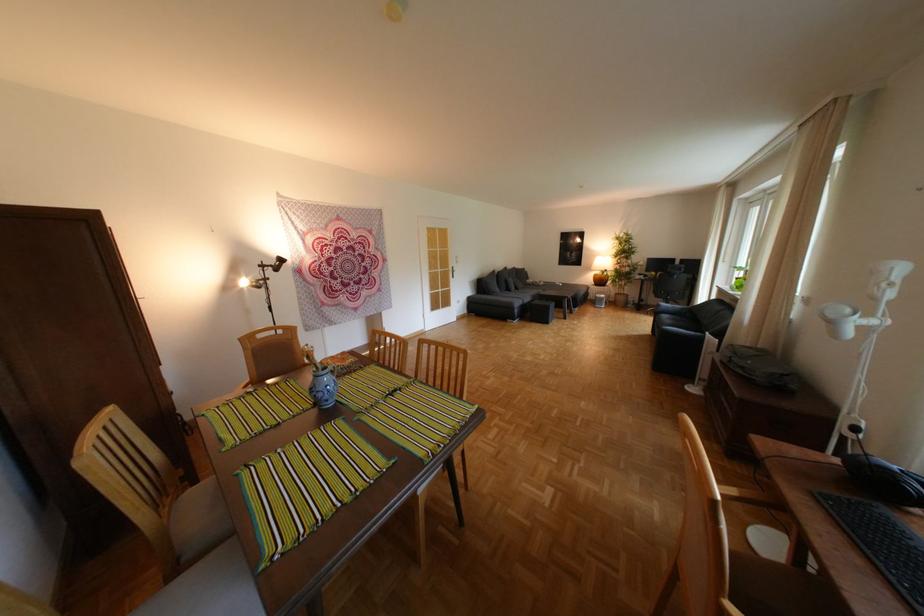
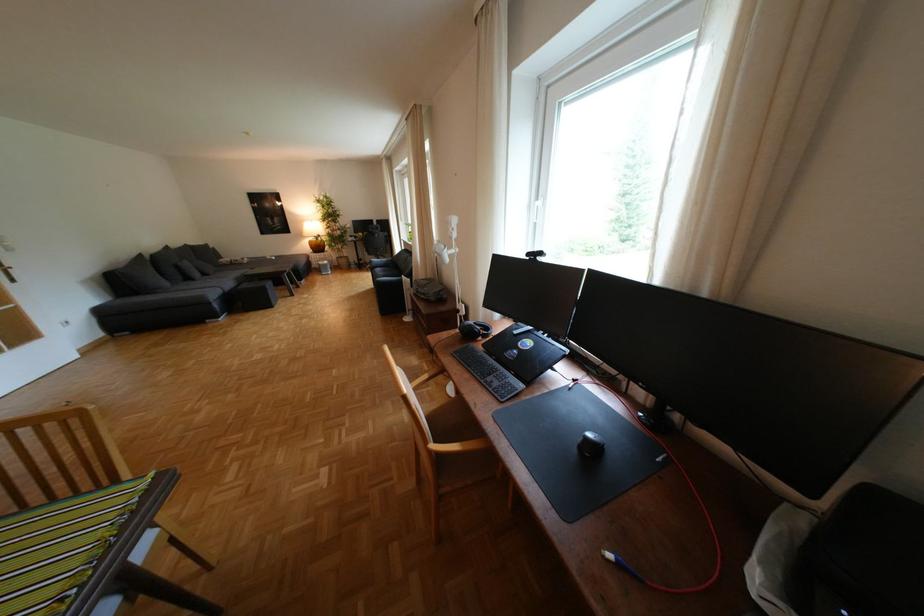
Question: The camera is either moving clockwise (left) or counter-clockwise (right) around the object. The first image is from the beginning of the video and the second image is from the end. Is the camera moving left or right when shooting the video?

Choices:
 (A) Left
 (B) Right

Answer: (A)